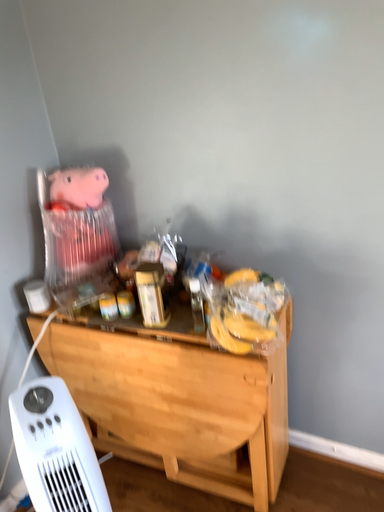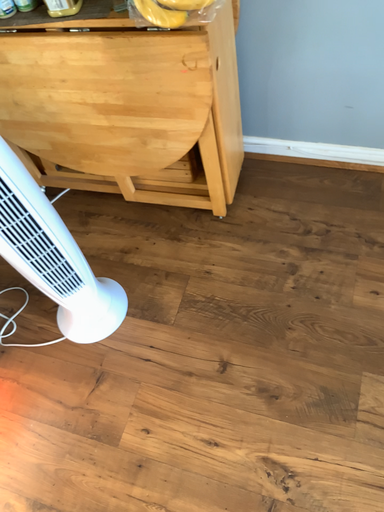
Question: How did the camera likely rotate when shooting the video?

Choices:
 (A) rotated upward
 (B) rotated downward

Answer: (B)